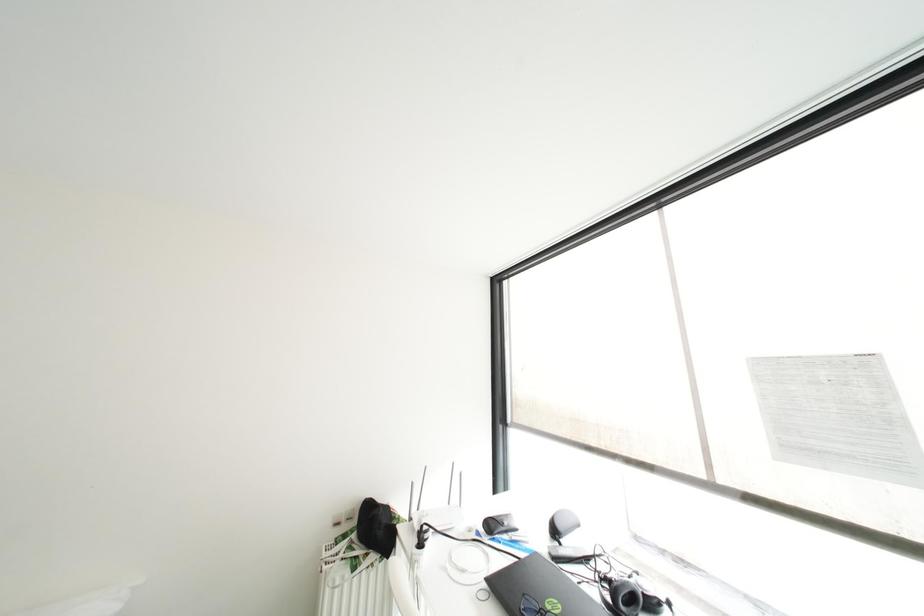
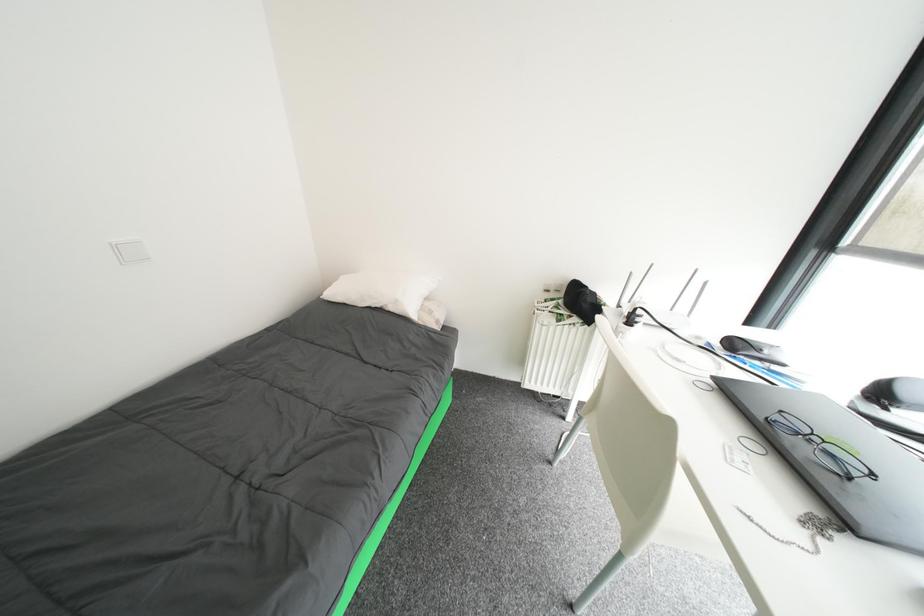
Based on the continuous images, in which direction is the camera rotating?

The rotation direction of the camera is left-down.